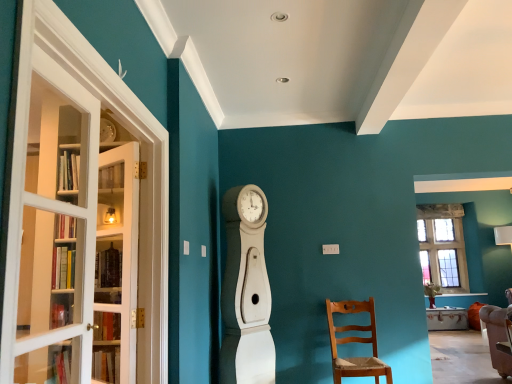
Question: Considering the relative positions of white wood clock at center and white glass door at left in the image provided, is white wood clock at center in front of white glass door at left?

Choices:
 (A) no
 (B) yes

Answer: (A)

Question: Would you consider white wood clock at center to be distant from white glass door at left?

Choices:
 (A) yes
 (B) no

Answer: (A)

Question: Can you confirm if white wood clock at center is shorter than white glass door at left?

Choices:
 (A) yes
 (B) no

Answer: (B)

Question: Can you confirm if white wood clock at center is thinner than white glass door at left?

Choices:
 (A) no
 (B) yes

Answer: (A)

Question: Is white wood clock at center positioned with its back to white glass door at left?

Choices:
 (A) yes
 (B) no

Answer: (B)

Question: Is white wood clock at center oriented towards white glass door at left?

Choices:
 (A) yes
 (B) no

Answer: (B)

Question: Considering the relative positions of light brown wooden chair at lower right and white wood clock at center in the image provided, is light brown wooden chair at lower right behind white wood clock at center?

Choices:
 (A) no
 (B) yes

Answer: (B)

Question: Can you confirm if light brown wooden chair at lower right is bigger than white wood clock at center?

Choices:
 (A) yes
 (B) no

Answer: (B)

Question: Is light brown wooden chair at lower right located outside white wood clock at center?

Choices:
 (A) yes
 (B) no

Answer: (A)

Question: Can white wood clock at center be found inside light brown wooden chair at lower right?

Choices:
 (A) no
 (B) yes

Answer: (A)

Question: Is light brown wooden chair at lower right touching white wood clock at center?

Choices:
 (A) yes
 (B) no

Answer: (B)

Question: From the image's perspective, would you say light brown wooden chair at lower right is shown under white wood clock at center?

Choices:
 (A) yes
 (B) no

Answer: (A)

Question: Is white glass door at left with light brown wooden chair at lower right?

Choices:
 (A) no
 (B) yes

Answer: (A)